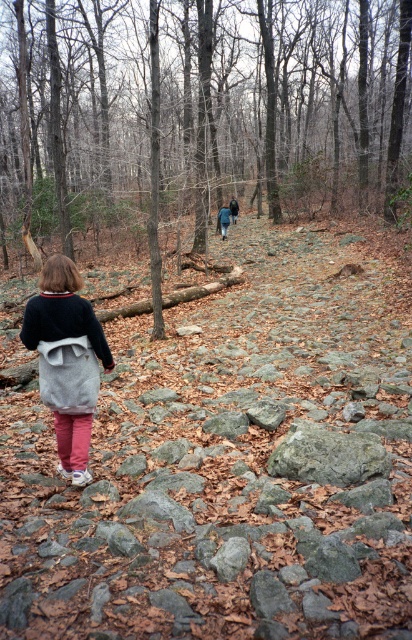
Describe the element at coordinates (226, 460) in the screenshot. Image resolution: width=412 pixels, height=640 pixels. I see `rough textured rocks at center` at that location.

Can you confirm if rough textured rocks at center is positioned to the right of brown rocky trail at center?

Correct, you'll find rough textured rocks at center to the right of brown rocky trail at center.

Which is in front, point (0, 560) or point (0, 200)?

Positioned in front is point (0, 560).

At what (x,y) coordinates should I click in order to perform the action: click on rough textured rocks at center. Please return your answer as a coordinate pair (x, y). Image resolution: width=412 pixels, height=640 pixels. Looking at the image, I should click on (226, 460).

Is point (381, 326) positioned in front of point (358, 483)?

That is False.

Is rough textured rocks at center bigger than gray rough rock at center?

Yes, rough textured rocks at center is bigger than gray rough rock at center.

Measure the distance between rough textured rocks at center and camera.

The distance of rough textured rocks at center from camera is 2.56 meters.

Locate an element on the screen. The height and width of the screenshot is (640, 412). rough textured rocks at center is located at coordinates (226, 460).

Who is positioned more to the right, brown rocky trail at center or gray rough rock at center?

gray rough rock at center is more to the right.

Is brown rocky trail at center shorter than gray rough rock at center?

In fact, brown rocky trail at center may be taller than gray rough rock at center.

The image size is (412, 640). I want to click on brown rocky trail at center, so click(198, 109).